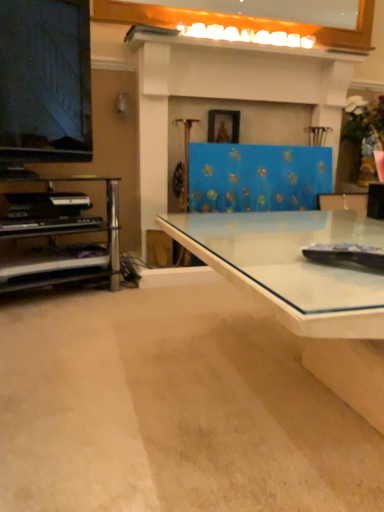
Question: Is transparent glass desk at center bigger or smaller than metallic silver shelf at left?

Choices:
 (A) big
 (B) small

Answer: (A)

Question: Is transparent glass desk at center wider or thinner than metallic silver shelf at left?

Choices:
 (A) thin
 (B) wide

Answer: (B)

Question: Which object is positioned closest to the white glossy mantle at upper center?

Choices:
 (A) transparent glass desk at center
 (B) matte black television at left
 (C) metallic silver shelf at left
 (D) black matte piano at left

Answer: (B)

Question: Considering the real-world distances, which object is farthest from the matte black television at left?

Choices:
 (A) transparent glass desk at center
 (B) white glossy mantle at upper center
 (C) metallic silver shelf at left
 (D) black matte piano at left

Answer: (A)